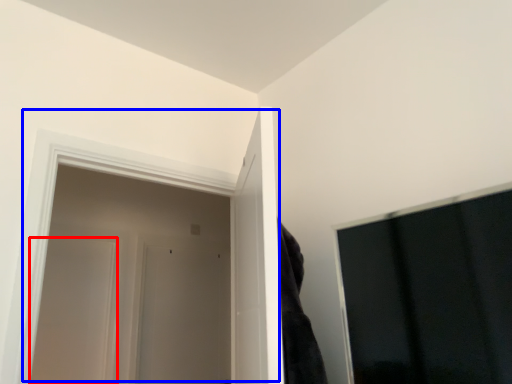
Question: Which point is closer to the camera, door (highlighted by a red box) or door (highlighted by a blue box)?

Choices:
 (A) door
 (B) door

Answer: (B)